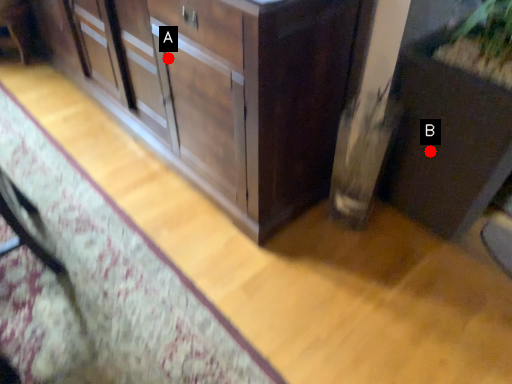
Question: Two points are circled on the image, labeled by A and B beside each circle. Which point is farther from the camera taking this photo?

Choices:
 (A) A is further
 (B) B is further

Answer: (A)